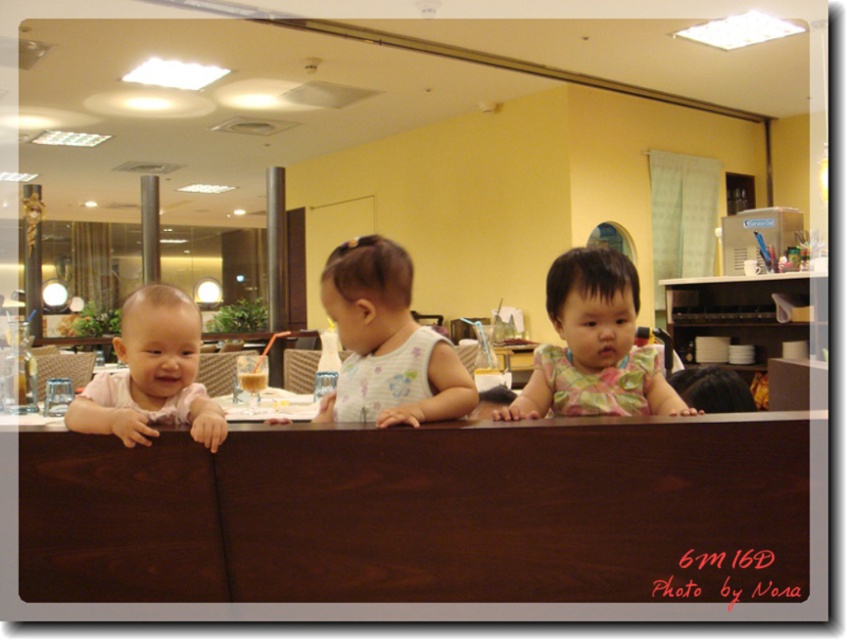
Is dark wood table at center shorter than matte pink shirt at left?

No.

Who is more distant from viewer, (x=268, y=524) or (x=139, y=420)?

Point (x=139, y=420)

Image resolution: width=847 pixels, height=640 pixels. I want to click on dark wood table at center, so (424, 513).

Based on the photo, between white floral tank top at center and floral fabric dress at center, which one appears on the left side from the viewer's perspective?

white floral tank top at center is more to the left.

Between point (374, 304) and point (630, 330), which one is positioned in front?

Positioned in front is point (630, 330).

Which is behind, point (352, 385) or point (613, 406)?

The point (352, 385) is more distant.

Identify the location of white floral tank top at center. The height and width of the screenshot is (640, 847). (386, 342).

Is dark wood table at center thinner than floral fabric dress at center?

No, dark wood table at center is not thinner than floral fabric dress at center.

Which is above, dark wood table at center or floral fabric dress at center?

floral fabric dress at center is above.

This screenshot has height=640, width=847. What are the coordinates of `dark wood table at center` in the screenshot? It's located at (424, 513).